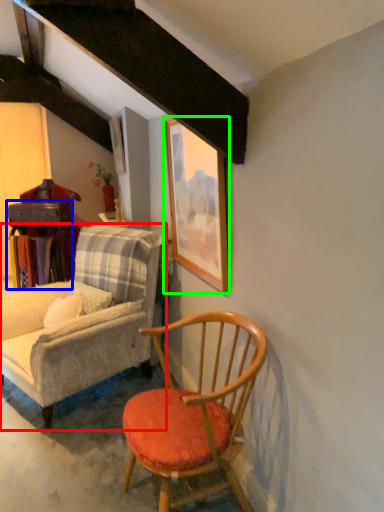
Question: Which object is positioned farthest from chair (highlighted by a red box)? Select from table (highlighted by a blue box) and picture frame (highlighted by a green box).

Choices:
 (A) table
 (B) picture frame

Answer: (A)